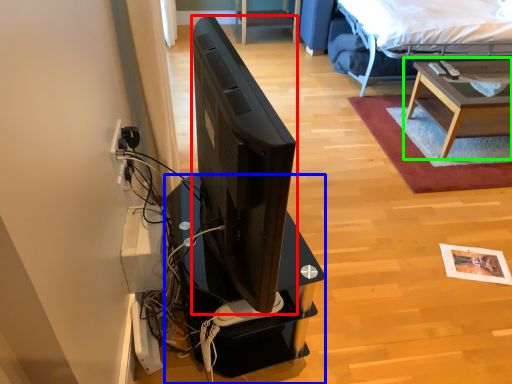
Question: Based on their relative distances, which object is farther from television (highlighted by a red box)? Choose from desk (highlighted by a blue box) and table (highlighted by a green box).

Choices:
 (A) desk
 (B) table

Answer: (B)